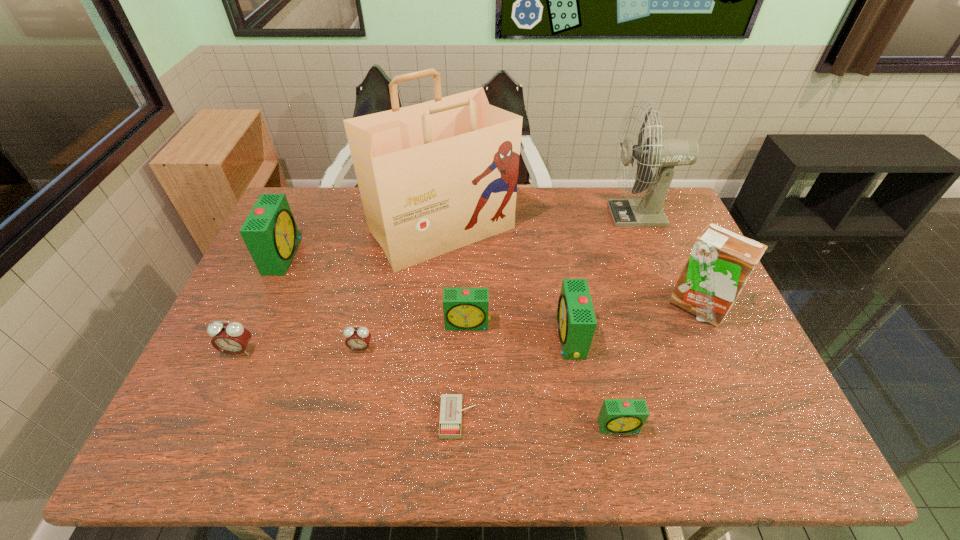
Find the location of `vacant space located on the air flow direction of the ninth shortest object`. vacant space located on the air flow direction of the ninth shortest object is located at coordinates (594, 214).

Where is `vacant position located on the air flow direction of the ninth shortest object`? vacant position located on the air flow direction of the ninth shortest object is located at coordinates (563, 214).

Find the location of `vacant space located on the straw side of the eighth shortest object`. vacant space located on the straw side of the eighth shortest object is located at coordinates (738, 401).

Locate an element on the screen. vacant point located 0.130m on the front-facing side of the leftmost green alarm clock is located at coordinates (337, 255).

Where is `vacant area situated 0.380m on the front-facing side of the second tallest alarm clock`? The width and height of the screenshot is (960, 540). vacant area situated 0.380m on the front-facing side of the second tallest alarm clock is located at coordinates (413, 338).

Identify the location of blank area located on the front-facing side of the second tallest alarm clock. The width and height of the screenshot is (960, 540). (490, 338).

This screenshot has height=540, width=960. I want to click on vacant space located on the front-facing side of the second tallest alarm clock, so click(420, 338).

Image resolution: width=960 pixels, height=540 pixels. Find the location of `vacant space situated 0.160m on the clock face of the bigger pink alarm clock`. vacant space situated 0.160m on the clock face of the bigger pink alarm clock is located at coordinates (208, 417).

Where is `vacant space located 0.250m on the front-facing side of the fourth alarm clock from left to right`? vacant space located 0.250m on the front-facing side of the fourth alarm clock from left to right is located at coordinates [466, 420].

Locate an element on the screen. The width and height of the screenshot is (960, 540). vacant position located on the clock face of the third alarm clock from left to right is located at coordinates (352, 389).